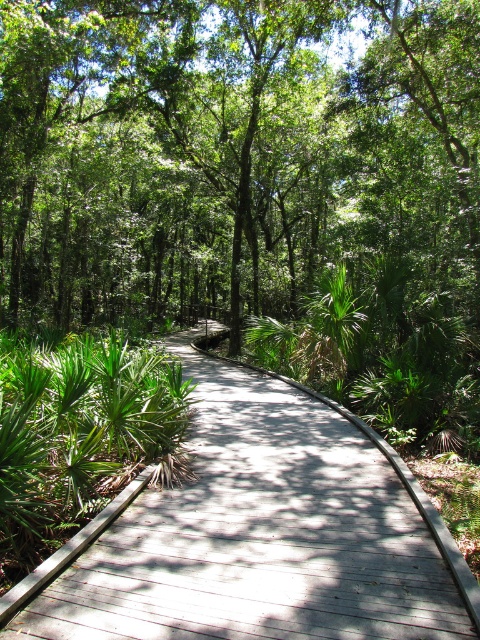
Which of these two, green leafy tree at center or wooden boardwalk at center, stands shorter?

With less height is wooden boardwalk at center.

The image size is (480, 640). Describe the element at coordinates (229, 150) in the screenshot. I see `green leafy tree at center` at that location.

What are the coordinates of `green leafy tree at center` in the screenshot? It's located at (229, 150).